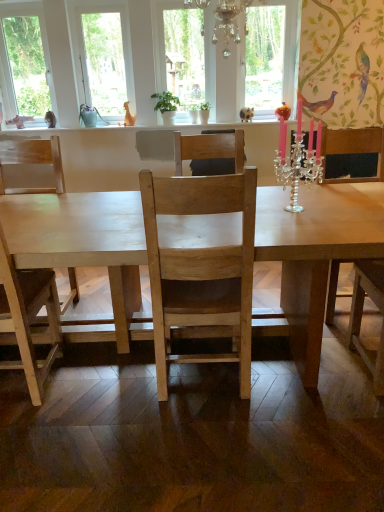
Image resolution: width=384 pixels, height=512 pixels. What are the coordinates of `empty space that is to the right of silver/crystal candle holder at upper right` in the screenshot? It's located at (336, 210).